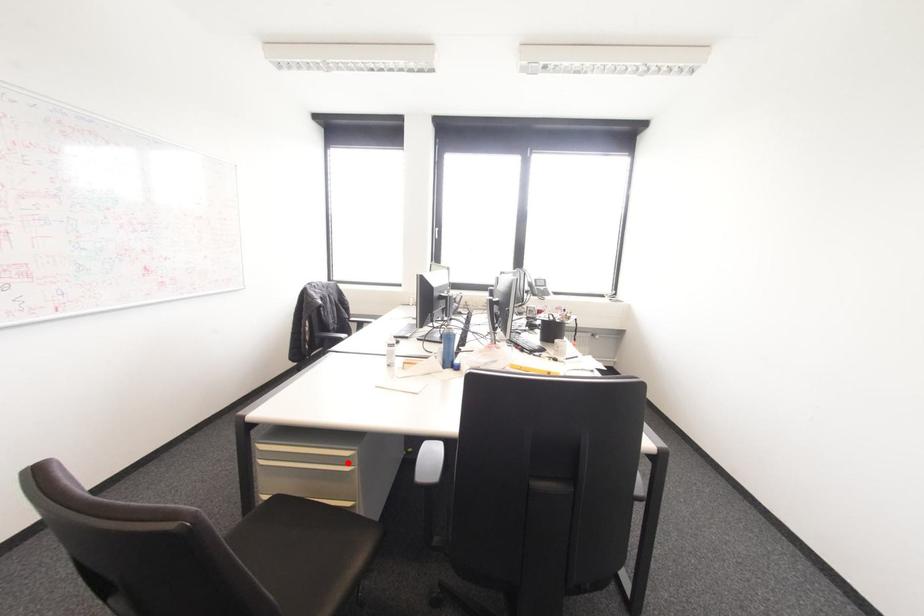
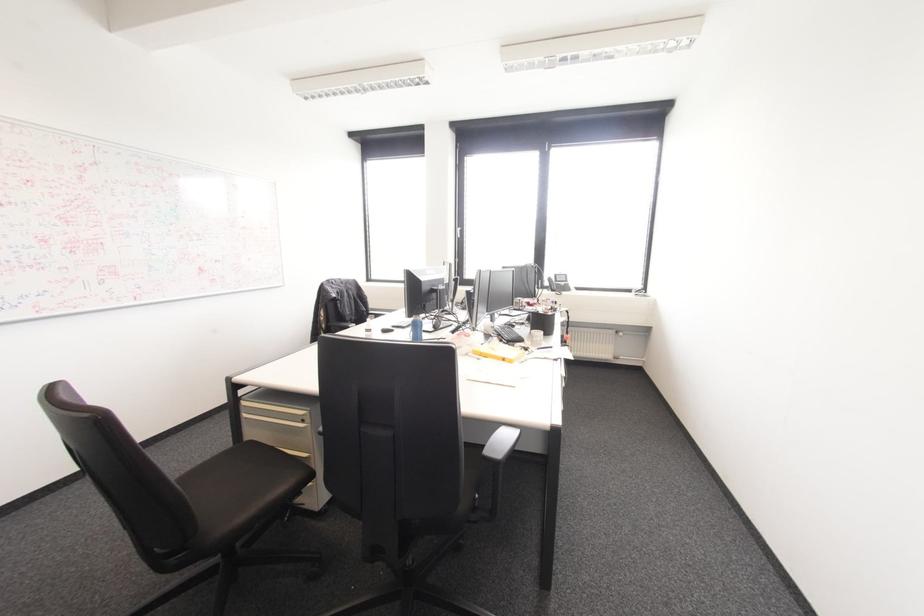
Locate, in the second image, the point that corresponds to the highlighted location in the first image.

(302, 419)